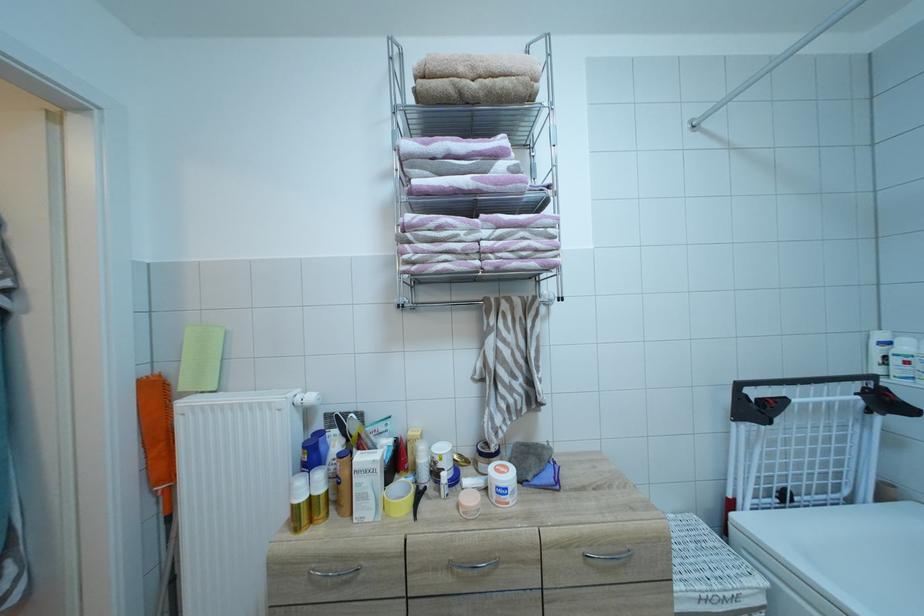
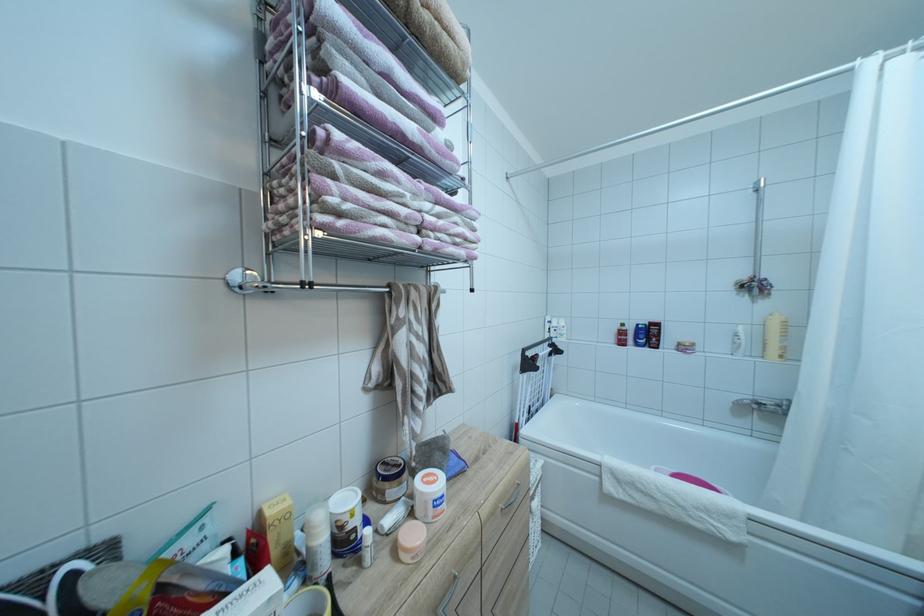
Question: The images are taken continuously from a first-person perspective. In which direction is your viewpoint rotating?

Choices:
 (A) Left
 (B) Right
 (C) Up
 (D) Down

Answer: (B)